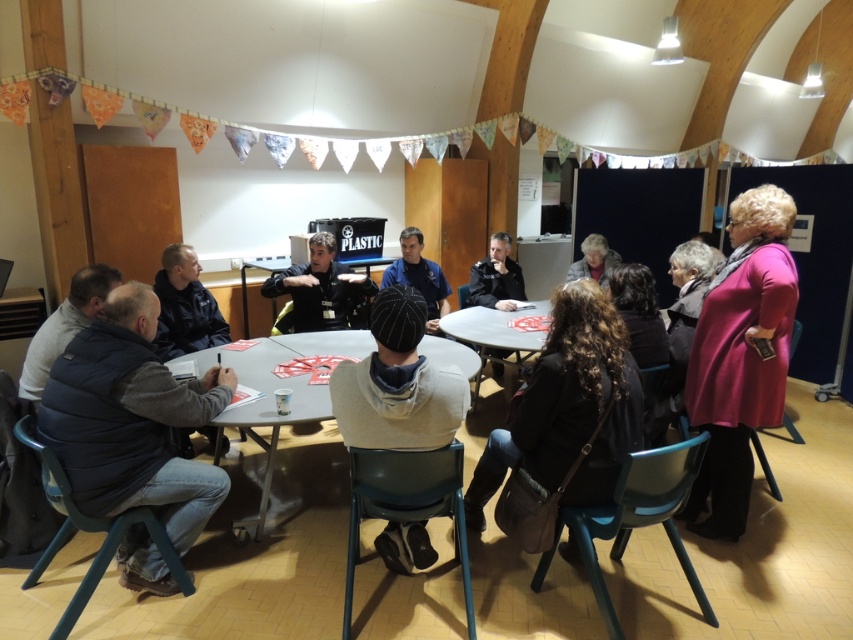
Question: Among these objects, which one is farthest from the camera?

Choices:
 (A) striped knit cap at center
 (B) white plastic table at center

Answer: (B)

Question: In this image, where is matte black cap at center located relative to matte black hair at upper center?

Choices:
 (A) left
 (B) right

Answer: (A)

Question: Can you confirm if matte plastic table at center is thinner than black matte jacket at lower left?

Choices:
 (A) yes
 (B) no

Answer: (B)

Question: Which object appears farthest from the camera in this image?

Choices:
 (A) dark brown leather bag at lower center
 (B) black matte jacket at lower left
 (C) black matte jacket at center
 (D) gray matte vest at lower left

Answer: (C)

Question: Considering the real-world distances, which object is farthest from the dark brown leather bag at lower center?

Choices:
 (A) matte black cap at center
 (B) dark blue puffer vest at lower left

Answer: (A)

Question: Is dark blue puffer vest at lower left smaller than black leather jacket at center?

Choices:
 (A) yes
 (B) no

Answer: (B)